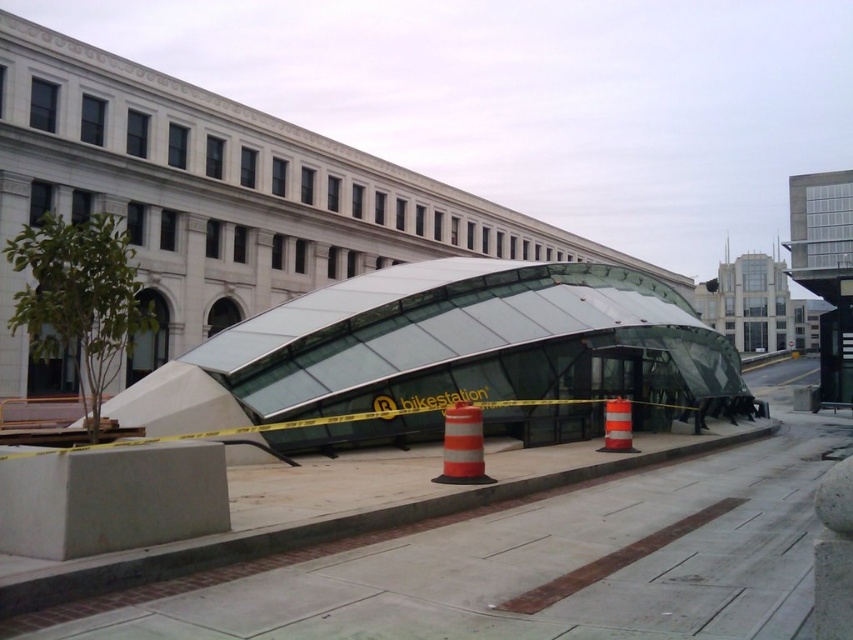
Between concrete at center and orange reflective traffic cone at center, which one has more height?

With more height is concrete at center.

Which is below, concrete at center or orange reflective traffic cone at center?

concrete at center is lower down.

The image size is (853, 640). I want to click on concrete at center, so click(526, 564).

Is orange reflective cone at center positioned behind orange reflective traffic cone at center?

No, orange reflective cone at center is closer to the viewer.

Who is more forward, (451, 476) or (630, 406)?

Point (451, 476) is more forward.

Find the location of a particular element. orange reflective cone at center is located at coordinates (462, 445).

This screenshot has width=853, height=640. I want to click on concrete at center, so click(526, 564).

Between point (680, 518) and point (460, 465), which one is positioned behind?

Positioned behind is point (460, 465).

Where is `concrete at center`? This screenshot has height=640, width=853. concrete at center is located at coordinates (526, 564).